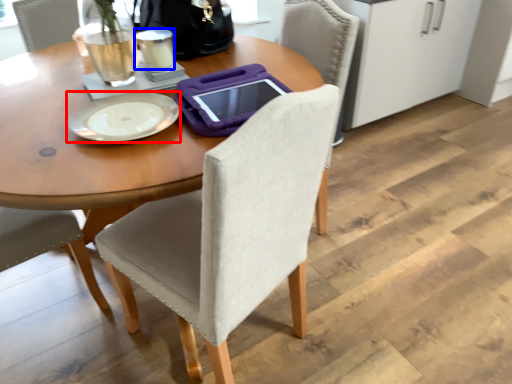
Question: Which object is further to the camera taking this photo, plate (highlighted by a red box) or coffee cup (highlighted by a blue box)?

Choices:
 (A) plate
 (B) coffee cup

Answer: (B)